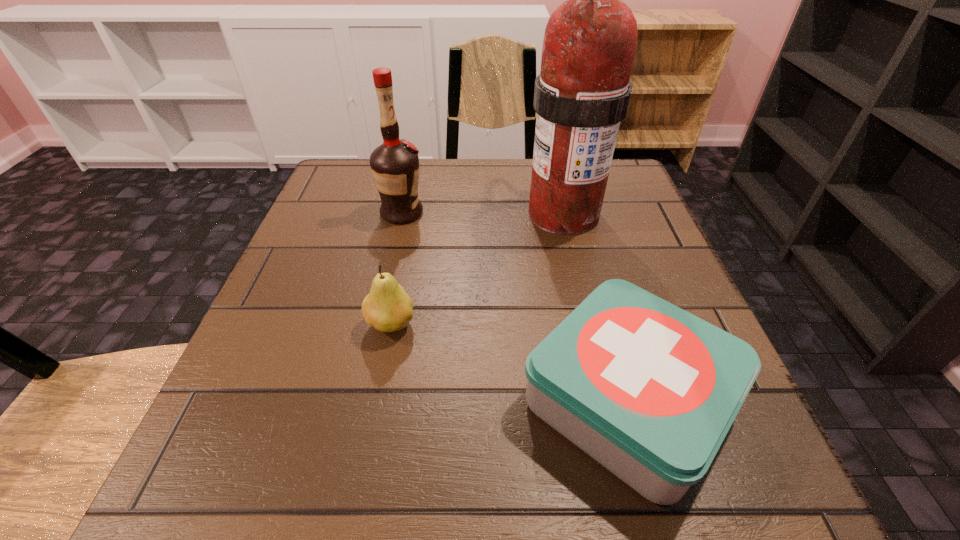
I want to click on the tallest object, so click(x=582, y=94).

Find the location of a particular element. the third shortest object is located at coordinates (394, 164).

Find the location of a particular element. the second shortest object is located at coordinates (387, 308).

You are a GUI agent. You are given a task and a screenshot of the screen. Output one action in this format:
    pyautogui.click(x=<x>, y=<y>)
    Task: Click on the first-aid kit
    The height and width of the screenshot is (540, 960).
    Given the screenshot: What is the action you would take?
    pyautogui.click(x=648, y=390)

What are the coordinates of `free space located at the nozzle of the fire extinguisher` in the screenshot? It's located at (584, 300).

What are the coordinates of `blank area located on the front and back of the third shortest object` in the screenshot? It's located at (575, 213).

Locate an element on the screen. free point located 0.180m on the back of the pear is located at coordinates (407, 240).

This screenshot has height=540, width=960. In order to click on free space located on the back of the shortest object in this screenshot , I will do `click(575, 208)`.

At what (x,y) coordinates should I click in order to perform the action: click on fire extinguisher present at the far edge. Please return your answer as a coordinate pair (x, y). Looking at the image, I should click on (582, 94).

The width and height of the screenshot is (960, 540). What are the coordinates of `liquor that is at the far edge` in the screenshot? It's located at (394, 164).